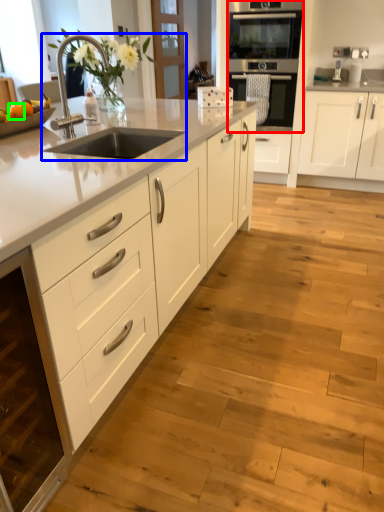
Question: Which is nearer to the oven (highlighted by a red box)? sink (highlighted by a blue box) or orange (highlighted by a green box).

Choices:
 (A) sink
 (B) orange

Answer: (A)